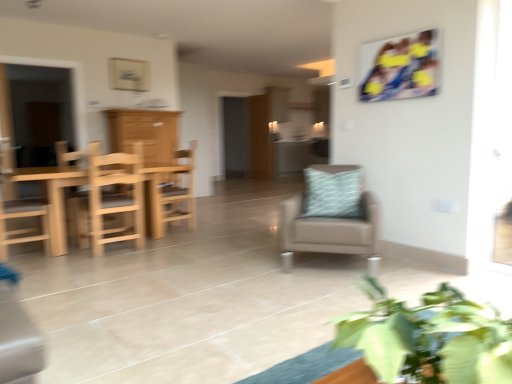
Question: Which is correct: light blue textured pillow at center is inside wooden cabinet at left, or outside of it?

Choices:
 (A) outside
 (B) inside

Answer: (A)

Question: From the image's perspective, is light blue textured pillow at center located above or below wooden cabinet at left?

Choices:
 (A) below
 (B) above

Answer: (A)

Question: Which is nearer to the natural wood chair at left, acting as the 2th chair starting from the left?

Choices:
 (A) green leafy plant at lower right
 (B) wooden door at center
 (C) wooden cabinet at left
 (D) light brown wooden table at left
 (E) wooden chair at center, which is the 2th chair from right to left

Answer: (D)

Question: Which object is positioned farthest from the suede beige chair at center, the 4th chair when ordered from left to right?

Choices:
 (A) light brown wooden chair at left, the 4th chair positioned from the right
 (B) wooden table at left
 (C) natural wood chair at left, positioned as the 3th chair in right-to-left order
 (D) light blue textured pillow at center
 (E) wooden cabinet at left

Answer: (B)